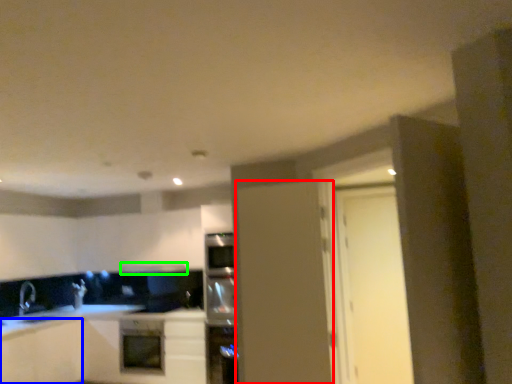
Question: Considering the real-world distances, which object is closest to door (highlighted by a red box)? cabinetry (highlighted by a blue box) or exhaust hood (highlighted by a green box).

Choices:
 (A) cabinetry
 (B) exhaust hood

Answer: (B)